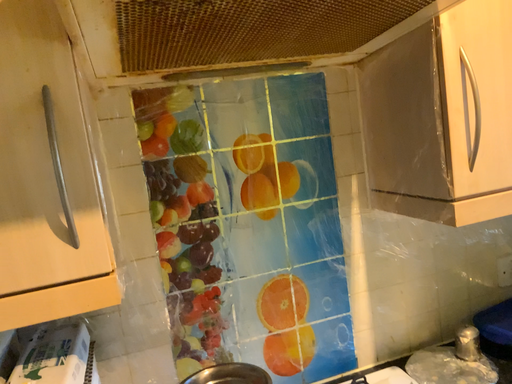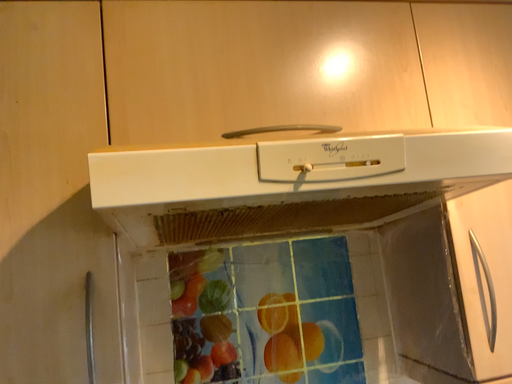
Question: Which way did the camera rotate in the video?

Choices:
 (A) rotated downward
 (B) rotated upward

Answer: (B)